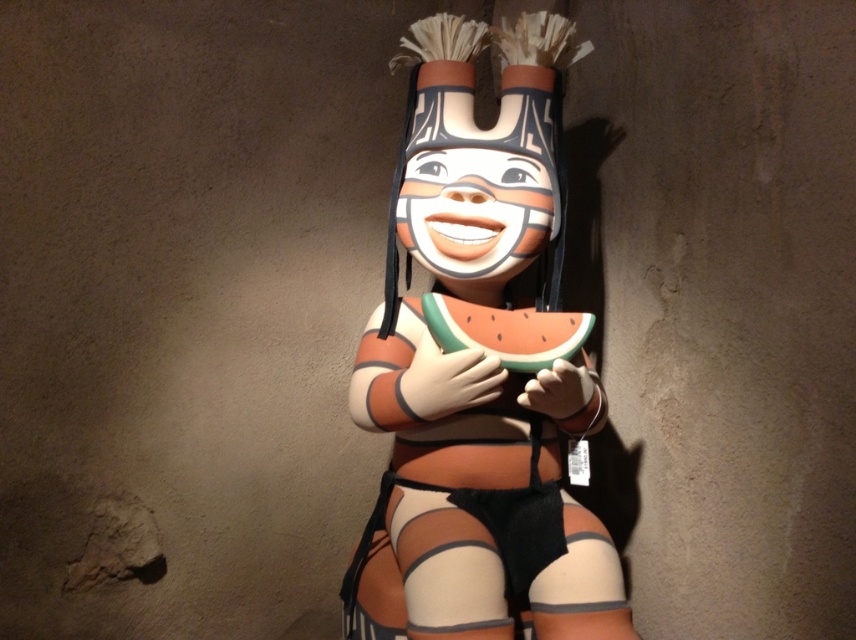
You are an art curator arranging an exhibition. You have a matte plastic kachina doll at center and a green matte watermelon at center. Which object is positioned closer to the front of the display?

The matte plastic kachina doll at center is closer to the viewer than the green matte watermelon at center, so it is positioned closer to the front of the display.

You are a store employee arranging items on a shelf. You have a matte plastic kachina doll at center and a green matte watermelon at center. The shelf has a width of 10 inches. Can both items fit side by side without overlapping?

The matte plastic kachina doll at center is 6.59 inches from the green matte watermelon at center, so if the distance between them is 6.59 inches, they can fit on a 10 inch shelf since 6.59 is less than 10.